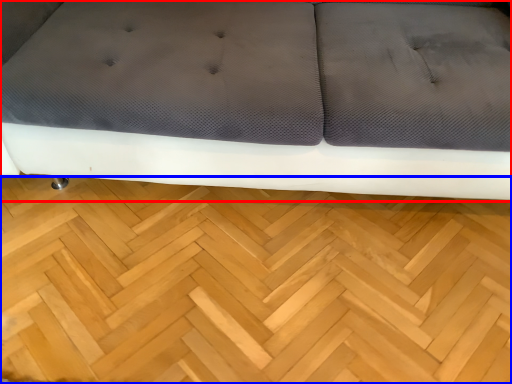
Question: Among these objects, which one is nearest to the camera, studio couch (highlighted by a red box) or hardwood (highlighted by a blue box)?

Choices:
 (A) studio couch
 (B) hardwood

Answer: (A)